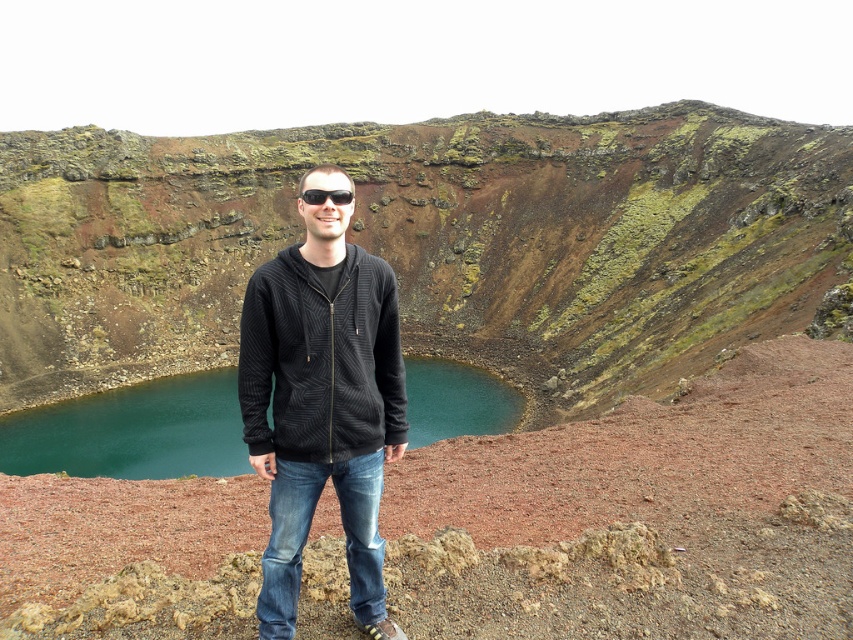
Question: Which of the following is the closest to the observer?

Choices:
 (A) (323, 198)
 (B) (36, 305)
 (C) (82, 460)

Answer: (A)

Question: Which point is farther to the camera?

Choices:
 (A) black textured zip-up hoodie at center
 (B) black plastic sunglasses at center
 (C) green mossy rock at center
 (D) black textured hoodie at center

Answer: (C)

Question: Can you confirm if teal glossy water at center is positioned to the right of black plastic sunglasses at center?

Choices:
 (A) yes
 (B) no

Answer: (B)

Question: Can you confirm if black textured hoodie at center is wider than black textured zip-up hoodie at center?

Choices:
 (A) no
 (B) yes

Answer: (B)

Question: Which of the following is the farthest from the observer?

Choices:
 (A) (346, 202)
 (B) (358, 419)

Answer: (A)

Question: Does green mossy rock at center have a smaller size compared to teal glossy water at center?

Choices:
 (A) no
 (B) yes

Answer: (A)